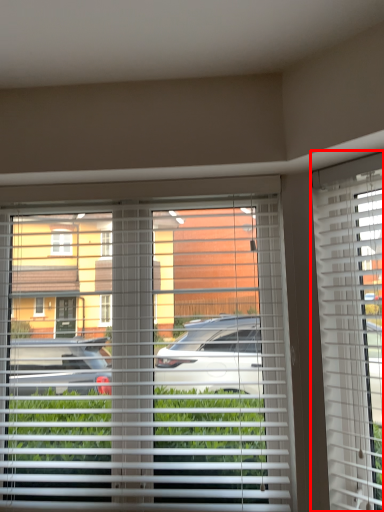
Question: From the image's perspective, what is the correct spatial positioning of window blind (annotated by the red box) in reference to window blind?

Choices:
 (A) below
 (B) above

Answer: (B)